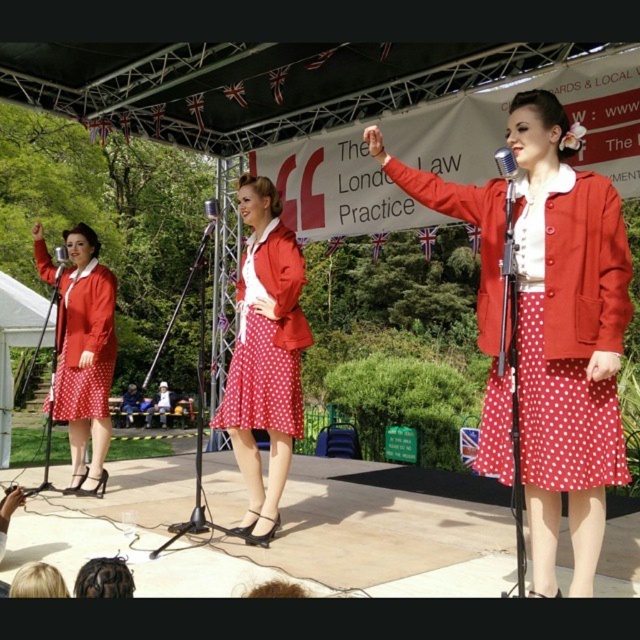
You are a photographer trying to capture a clear shot of both the matte red jacket at center and the polka dot fabric dress at center. Since you want to focus on the taller object first, which one should you adjust your camera to focus on?

The polka dot fabric dress at center is taller than the matte red jacket at center, so you should focus on the polka dot fabric dress at center first.

You are designing a costume for a performance and need to ensure the skirt and jacket fit together. Based on the image, which of the two items, the matte red skirt at center or the matte red jacket at center, has a greater width?

The matte red skirt at center has a greater width than the matte red jacket at center according to the description.

You are a costume designer trying to fit a new performer into the existing stage setup. Given that the matte red jacket at center and the polka dot fabric dress at center are part of the current outfit, which one would you choose if you want a more voluminous look for the new performer?

The matte red jacket at center has a larger size compared to the polka dot fabric dress at center, so choosing the matte red jacket at center would provide a more voluminous look for the new performer.